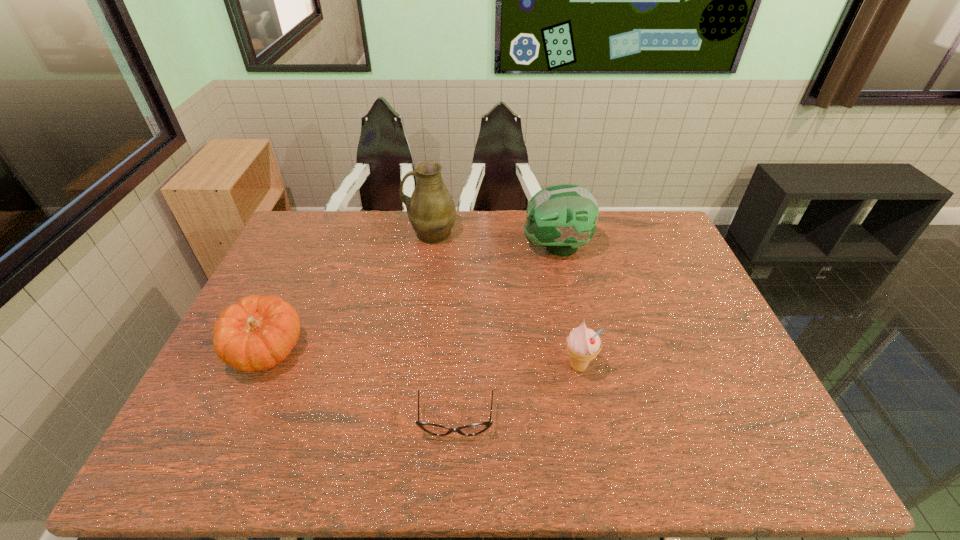
Locate an element on the screen. free space that satisfies the following two spatial constraints: 1. on the visor of the football helmet; 2. on the front side of the icecream is located at coordinates (581, 367).